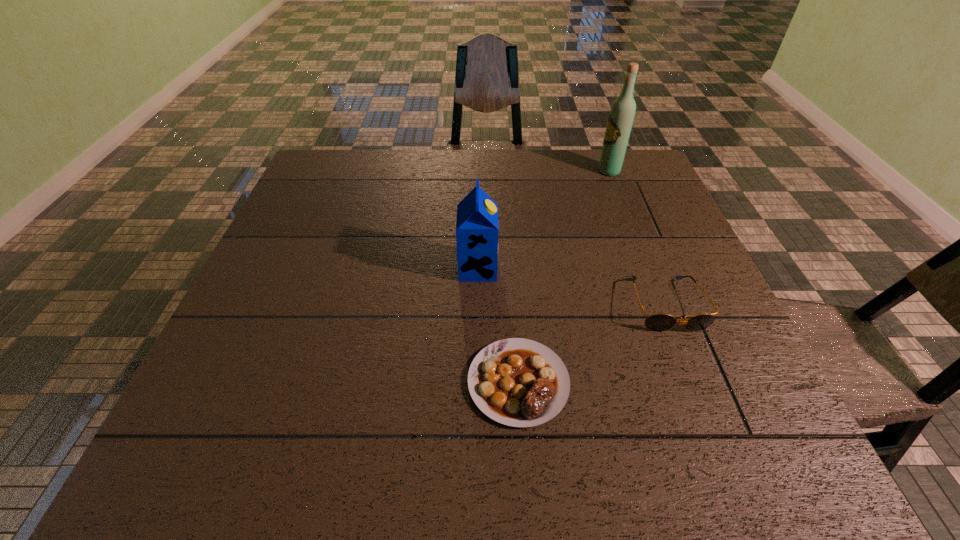
Locate an element on the screen. the tallest object is located at coordinates (621, 116).

The height and width of the screenshot is (540, 960). In order to click on the farthest object in this screenshot , I will do 621,116.

Where is `carton`? The width and height of the screenshot is (960, 540). carton is located at coordinates (477, 230).

Locate an element on the screen. sunglasses is located at coordinates (656, 322).

Find the location of a particular element. steak is located at coordinates click(x=517, y=382).

Find the location of a particular element. the shortest object is located at coordinates (517, 382).

You are a GUI agent. You are given a task and a screenshot of the screen. Output one action in this format:
    pyautogui.click(x=<x>, y=<y>)
    Task: Click on the vacant area located on the front-facing side of the wine bottle
    Image resolution: width=960 pixels, height=540 pixels.
    Given the screenshot: What is the action you would take?
    pyautogui.click(x=510, y=171)

Where is `vacant space positioned 0.260m on the front-facing side of the wine bottle`? vacant space positioned 0.260m on the front-facing side of the wine bottle is located at coordinates (513, 171).

This screenshot has height=540, width=960. I want to click on vacant space located on the front-facing side of the wine bottle, so click(x=516, y=171).

Locate an element on the screen. This screenshot has width=960, height=540. free space located 0.190m with the cap open on the second tallest object is located at coordinates (577, 268).